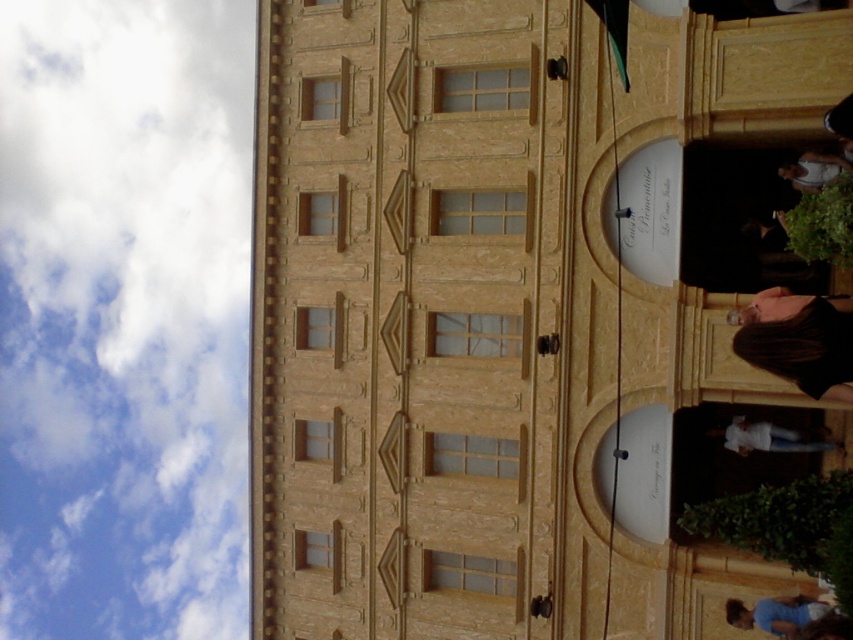
Question: Which object appears closest to the camera in this image?

Choices:
 (A) white cotton shirt at lower right
 (B) blue fabric skateboarder at lower right

Answer: (B)

Question: Does white fluffy cloud at upper left have a greater width compared to white cotton shirt at lower right?

Choices:
 (A) yes
 (B) no

Answer: (A)

Question: Among these objects, which one is nearest to the camera?

Choices:
 (A) brown hair at right
 (B) white fabric at right
 (C) blue fabric skateboarder at lower right

Answer: (A)

Question: Which point is farther to the camera?

Choices:
 (A) coord(230,211)
 (B) coord(828,164)
 (C) coord(281,588)
 (D) coord(772,324)

Answer: (A)

Question: Is white cotton shirt at lower right further to camera compared to white fabric at right?

Choices:
 (A) no
 (B) yes

Answer: (B)

Question: Does golden stone building at center have a greater width compared to brown hair at right?

Choices:
 (A) no
 (B) yes

Answer: (B)